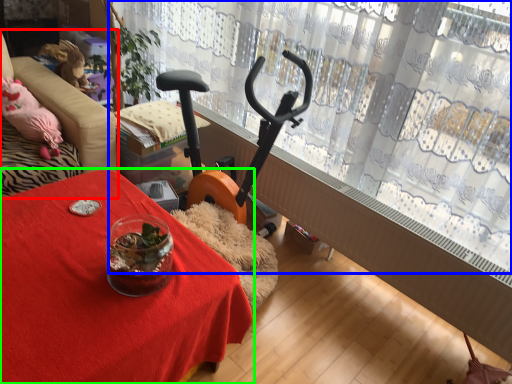
Question: Considering the real-world distances, which object is closest to furniture (highlighted by a red box)? curtain (highlighted by a blue box) or table (highlighted by a green box).

Choices:
 (A) curtain
 (B) table

Answer: (B)